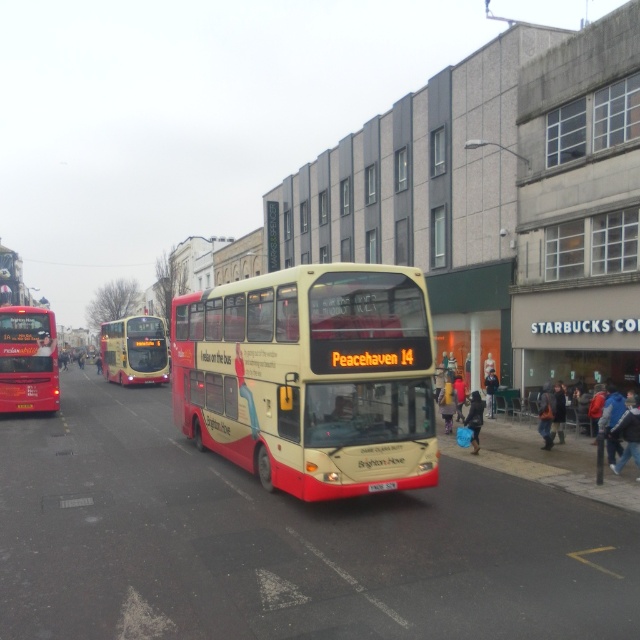
You are a pedestrian standing on the sidewalk looking at the yellow matte bus at center and the white plastic license plate at center. Which object is higher in the image?

The yellow matte bus at center is above the white plastic license plate at center, so the yellow matte bus at center is higher in the image.

You are a city planner analyzing traffic flow. You need to determine if the matte red bus at left can safely pass through a narrow alley that the yellow plastic bus at center currently fits in. Based on their widths, what is your assessment?

The matte red bus at left is wider than the yellow plastic bus at center, so it cannot safely pass through the alley if the yellow plastic bus at center fits just barely.

You are a city planner analyzing traffic flow. You observe the matte red bus at left and the yellow matte bus at center in the image. Which bus takes up more space in the scene?

The yellow matte bus at center occupies more space than the matte red bus at left.